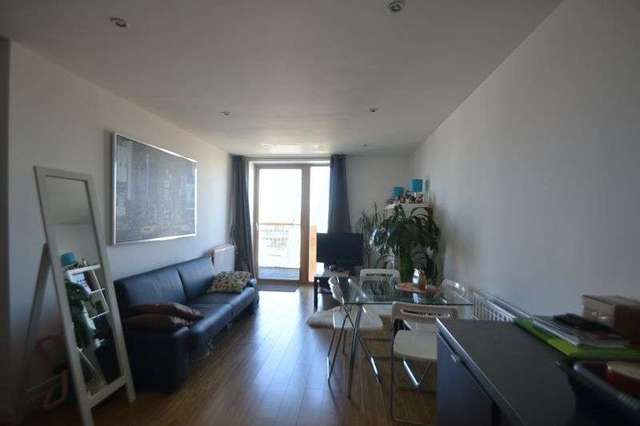
Find the location of a particular element. floor is located at coordinates (303, 363).